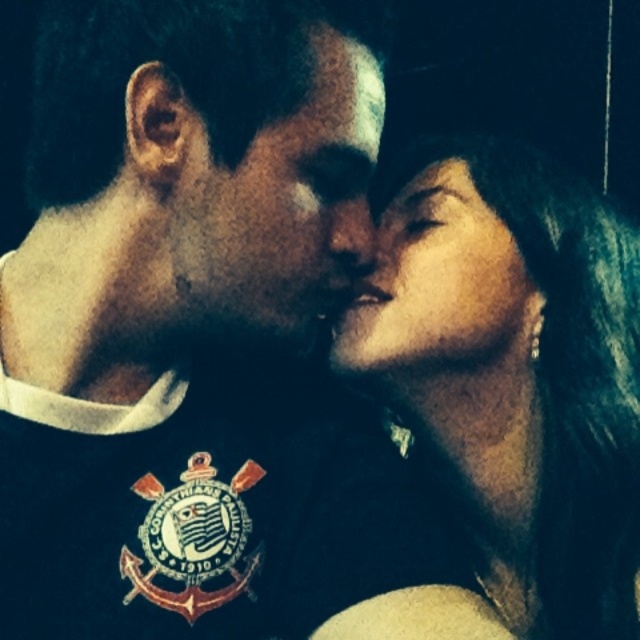
You are a photographer adjusting lighting for a portrait. You need to ensure that the matte black hair at upper right and the matte black face at center are both well lit. Which object requires more upward adjustment of the light source to achieve proper exposure?

The matte black hair at upper right requires more upward adjustment of the light source since it has a greater height compared to the matte black face at center, so raising the light will help illuminate it better.

You are a photographer adjusting the lighting for a portrait session. You notice two faces at the center of your frame, one with a matte black texture and the other with smooth skin. Given that the matte black face at center is narrower than the smooth skin face at center, which face would require more careful lighting to avoid harsh shadows?

The matte black face at center has a narrower width compared to the smooth skin face at center, so it might require more careful lighting to avoid harsh shadows due to its smaller surface area.

Based on the scene described, can you determine if the matte black hair at upper right is wider than the matte black face at center?

The matte black hair at upper right might be wider than matte black face at center according to the description.